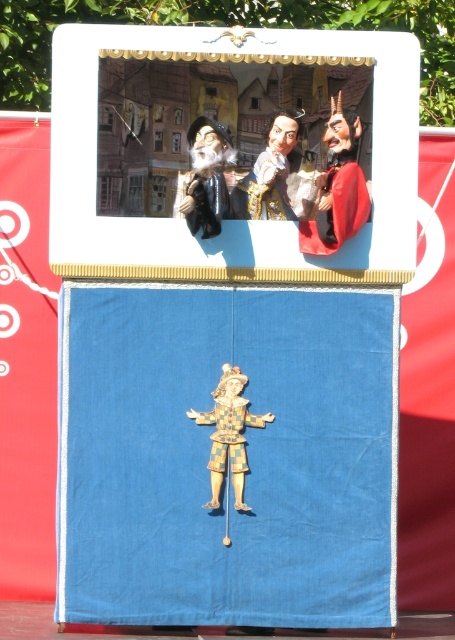
Does wooden clown at center appear on the left side of matte black puppet at upper center?

Incorrect, wooden clown at center is not on the left side of matte black puppet at upper center.

Can you confirm if wooden clown at center is taller than matte black puppet at upper center?

Yes.

Does point (227, 458) lie in front of point (187, 198)?

No, (227, 458) is further to viewer.

You are a GUI agent. You are given a task and a screenshot of the screen. Output one action in this format:
    pyautogui.click(x=<x>, y=<y>)
    Task: Click on the wooden clown at center
    The image size is (455, 640).
    Given the screenshot: What is the action you would take?
    pyautogui.click(x=228, y=433)

Who is positioned more to the right, smooth red mask at upper right or wooden clown at center?

Positioned to the right is smooth red mask at upper right.

Does smooth red mask at upper right have a lesser width compared to wooden clown at center?

Yes, smooth red mask at upper right is thinner than wooden clown at center.

Where is `smooth red mask at upper right`? The image size is (455, 640). smooth red mask at upper right is located at coordinates tap(338, 186).

Where is `smooth red mask at upper right`? This screenshot has height=640, width=455. smooth red mask at upper right is located at coordinates (338, 186).

Which is more to the left, matte black puppet at upper center or smooth leather mask at upper center?

Positioned to the left is matte black puppet at upper center.

Is the position of matte black puppet at upper center less distant than that of smooth leather mask at upper center?

That is True.

Is point (188, 214) closer to viewer compared to point (269, 128)?

Yes, it is in front of point (269, 128).

Locate an element on the screen. matte black puppet at upper center is located at coordinates (207, 177).